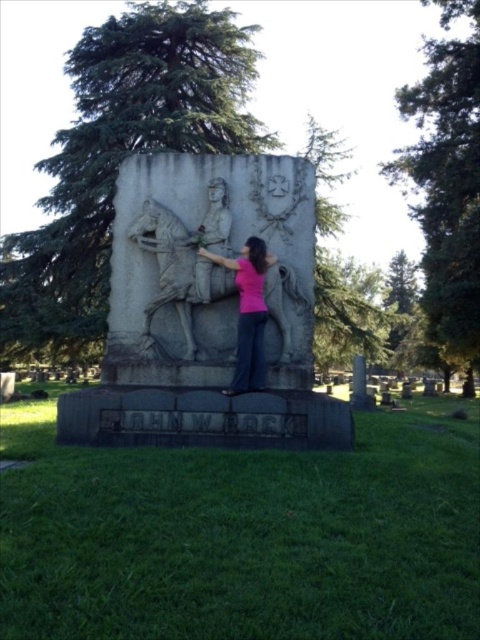
Question: Which object appears closest to the camera in this image?

Choices:
 (A) pink fabric at center
 (B) gray stone relief at center

Answer: (A)

Question: Does gray stone relief at center have a lesser width compared to pink fabric at center?

Choices:
 (A) no
 (B) yes

Answer: (A)

Question: Where is gray stone relief at center located in relation to pink fabric at center in the image?

Choices:
 (A) right
 (B) left

Answer: (B)

Question: Is the position of gray stone relief at center less distant than that of pink fabric at center?

Choices:
 (A) yes
 (B) no

Answer: (B)

Question: Among these points, which one is farthest from the camera?

Choices:
 (A) (211, 259)
 (B) (196, 157)

Answer: (B)